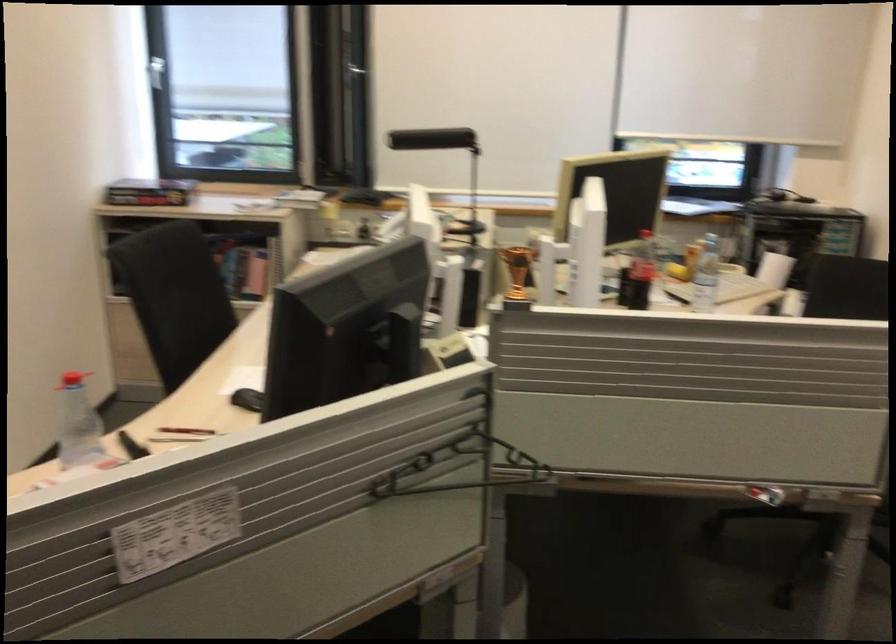
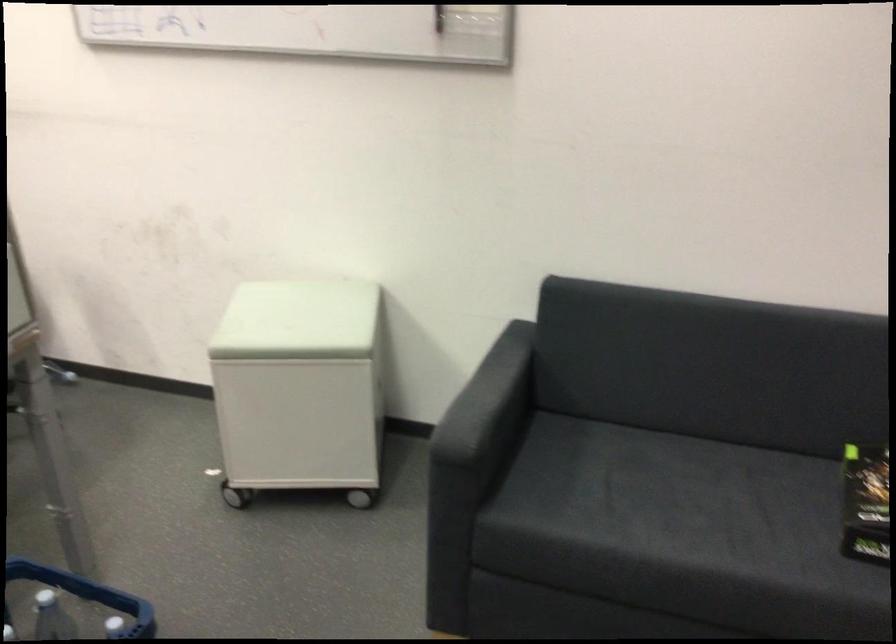
The first image is from the beginning of the video and the second image is from the end. How did the camera likely rotate when shooting the video?

The camera rotated toward right-down.